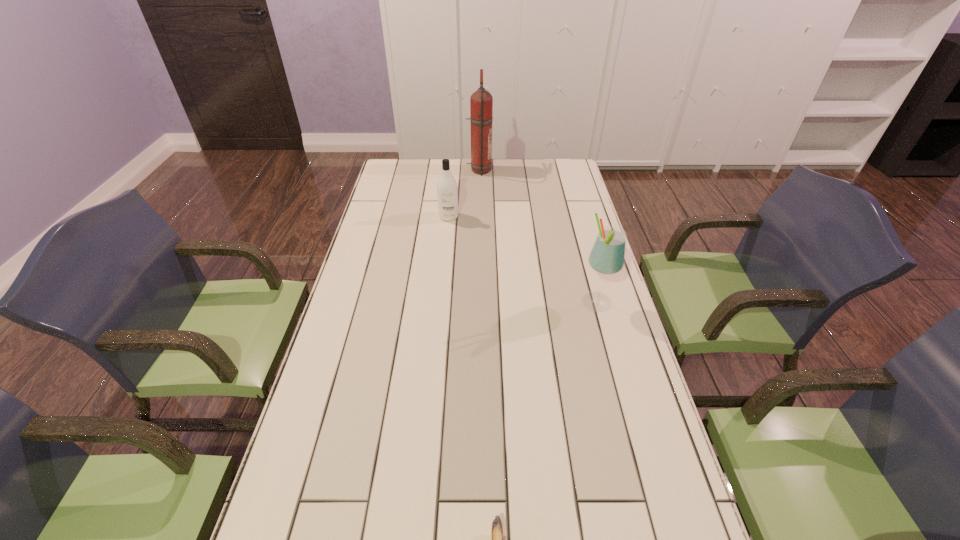
Locate an element on the screen. This screenshot has height=540, width=960. the farthest object is located at coordinates (481, 101).

Find the location of a particular element. Image resolution: width=960 pixels, height=540 pixels. the tallest object is located at coordinates (481, 101).

Where is `the second nearest object`? This screenshot has height=540, width=960. the second nearest object is located at coordinates (607, 256).

The height and width of the screenshot is (540, 960). I want to click on the rightmost object, so click(607, 256).

The height and width of the screenshot is (540, 960). Identify the location of the second farthest object. (447, 192).

This screenshot has height=540, width=960. Identify the location of shampoo. (447, 192).

You are a GUI agent. You are given a task and a screenshot of the screen. Output one action in this format:
    pyautogui.click(x=<x>, y=<y>)
    Task: Click on the free space located 0.330m on the side of the tallest object with the label and nozzle
    The image size is (960, 540).
    Given the screenshot: What is the action you would take?
    pyautogui.click(x=564, y=170)

At what (x,y) coordinates should I click in order to perform the action: click on vacant position located 0.260m on the left of the second tallest object. Please return your answer as a coordinate pair (x, y). Image resolution: width=960 pixels, height=540 pixels. Looking at the image, I should click on (495, 303).

The width and height of the screenshot is (960, 540). In order to click on vacant position located 0.330m on the front-facing side of the second farthest object in this screenshot , I will do `click(443, 279)`.

You are a GUI agent. You are given a task and a screenshot of the screen. Output one action in this format:
    pyautogui.click(x=<x>, y=<y>)
    Task: Click on the object that is at the far edge
    The height and width of the screenshot is (540, 960).
    Given the screenshot: What is the action you would take?
    pyautogui.click(x=481, y=101)